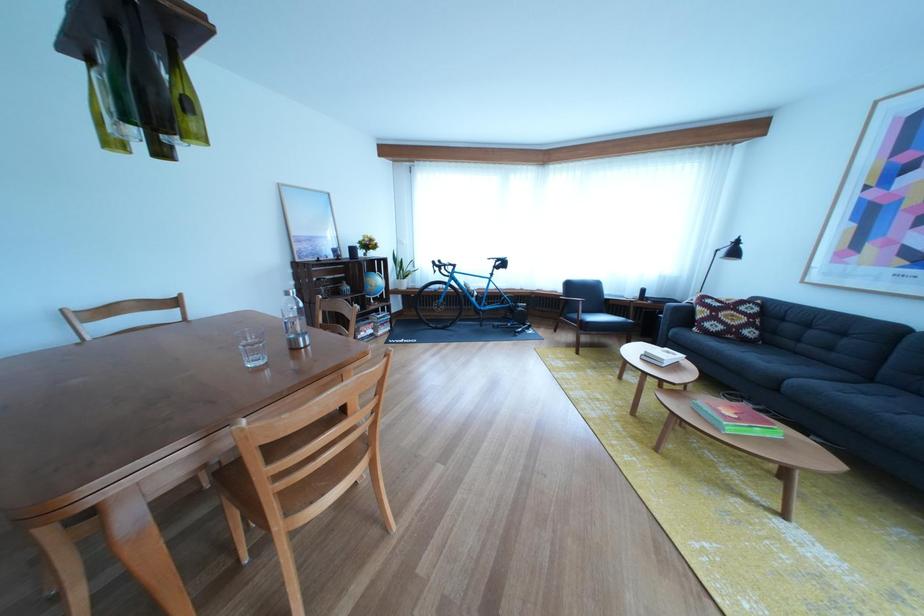
The image size is (924, 616). I want to click on black chair sitting surface, so click(x=602, y=317).